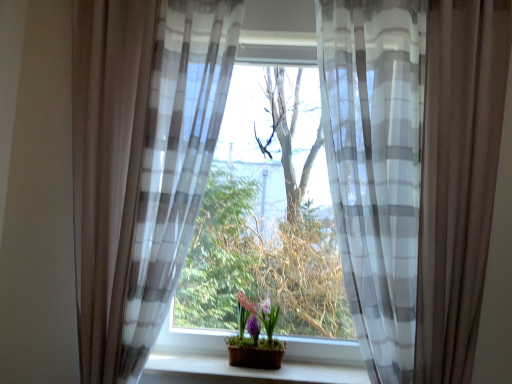
Question: From the image's perspective, is translucent fabric at center below sheer gray-white striped curtain at left, which appears as the second curtain when viewed from the right?

Choices:
 (A) no
 (B) yes

Answer: (B)

Question: Can you confirm if translucent fabric at center is wider than sheer gray-white striped curtain at left, which appears as the second curtain when viewed from the right?

Choices:
 (A) yes
 (B) no

Answer: (B)

Question: Can you confirm if translucent fabric at center is positioned to the left of sheer gray-white striped curtain at left, the 1th curtain when ordered from left to right?

Choices:
 (A) yes
 (B) no

Answer: (B)

Question: Are translucent fabric at center and sheer gray-white striped curtain at left, the 1th curtain when ordered from left to right, making contact?

Choices:
 (A) no
 (B) yes

Answer: (A)

Question: Is translucent fabric at center positioned with its back to sheer gray-white striped curtain at left, the 1th curtain when ordered from left to right?

Choices:
 (A) yes
 (B) no

Answer: (B)

Question: Is translucent fabric at center smaller than sheer gray-white striped curtain at left, the 1th curtain when ordered from left to right?

Choices:
 (A) yes
 (B) no

Answer: (B)

Question: Is wooden at center shorter than sheer gray-white striped curtain at left, the 1th curtain when ordered from left to right?

Choices:
 (A) yes
 (B) no

Answer: (A)

Question: From the image's perspective, is wooden at center above sheer gray-white striped curtain at left, which appears as the second curtain when viewed from the right?

Choices:
 (A) no
 (B) yes

Answer: (A)

Question: Is wooden at center aimed at sheer gray-white striped curtain at left, which appears as the second curtain when viewed from the right?

Choices:
 (A) no
 (B) yes

Answer: (A)

Question: Is the depth of wooden at center less than that of sheer gray-white striped curtain at left, the 1th curtain when ordered from left to right?

Choices:
 (A) no
 (B) yes

Answer: (A)

Question: Is wooden at center positioned far away from sheer gray-white striped curtain at left, which appears as the second curtain when viewed from the right?

Choices:
 (A) no
 (B) yes

Answer: (A)

Question: Does wooden at center have a lesser width compared to sheer gray-white striped curtain at left, the 1th curtain when ordered from left to right?

Choices:
 (A) yes
 (B) no

Answer: (A)

Question: From a real-world perspective, does sheer white and gray striped curtain at center, which is the first curtain in right-to-left order, sit lower than matte purple pot at center?

Choices:
 (A) yes
 (B) no

Answer: (B)